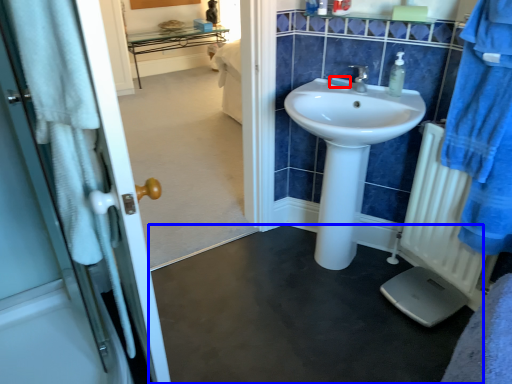
Question: Which object appears closest to the camera in this image, soap (highlighted by a red box) or plain (highlighted by a blue box)?

Choices:
 (A) soap
 (B) plain

Answer: (B)